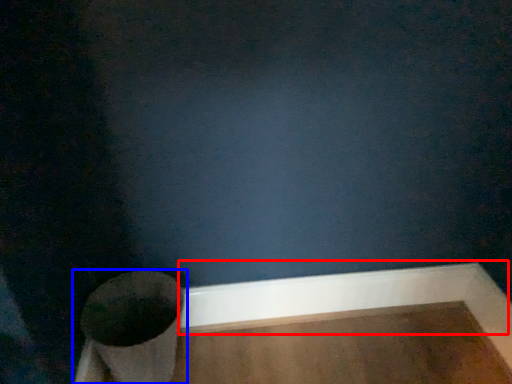
Question: Which of the following is the farthest to the observer, molding (highlighted by a red box) or toilet (highlighted by a blue box)?

Choices:
 (A) molding
 (B) toilet

Answer: (A)